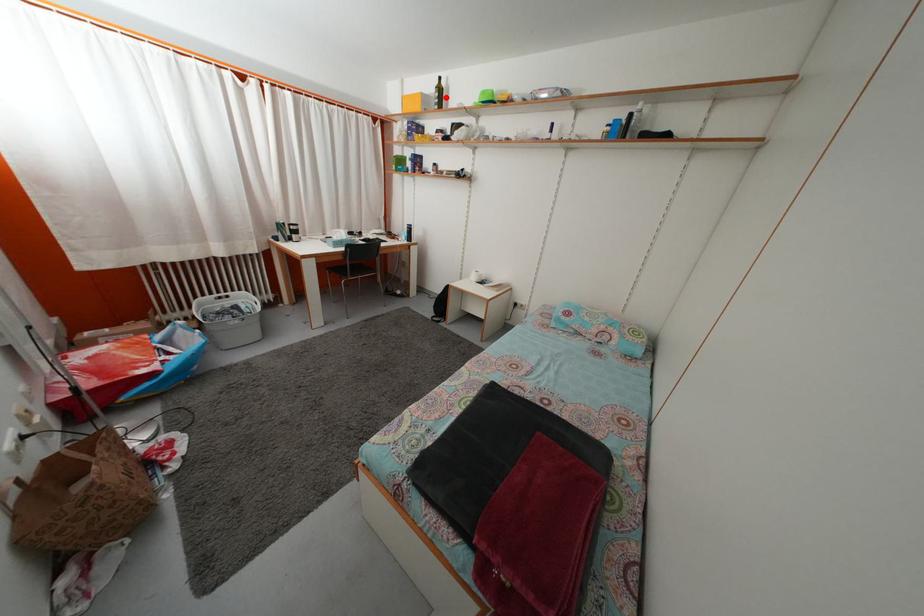
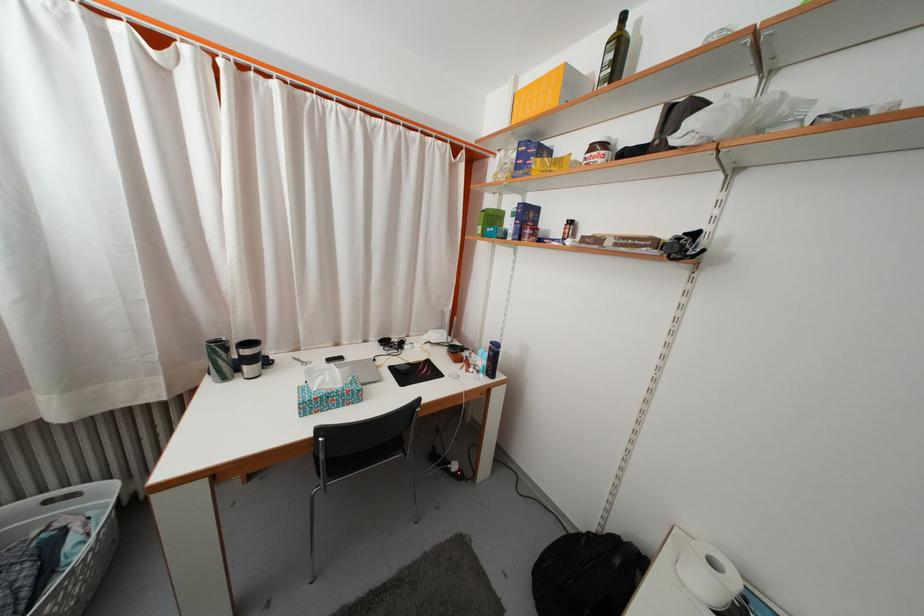
Question: I am providing you with two images of the same scene from different viewpoints. Given a red point in image1, look at the same physical point in image2. Is it:

Choices:
 (A) Closer to the viewpoint
 (B) Farther from the viewpoint

Answer: (B)